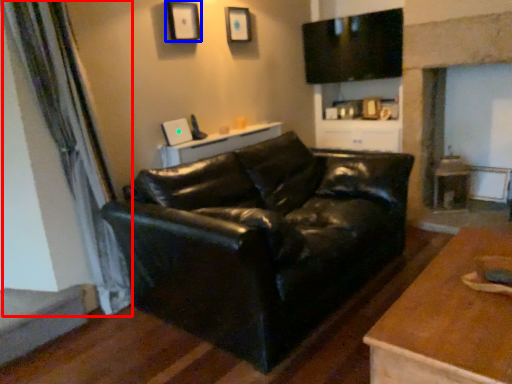
Question: Which of the following is the closest to the observer, curtain (highlighted by a red box) or picture frame (highlighted by a blue box)?

Choices:
 (A) curtain
 (B) picture frame

Answer: (A)